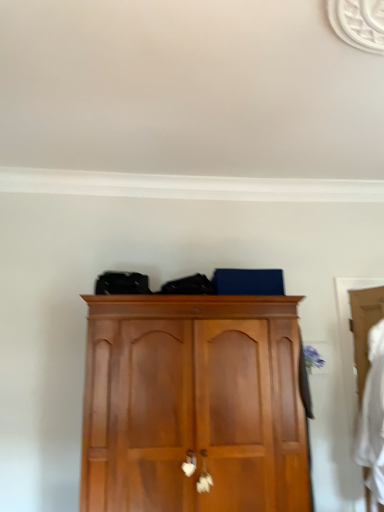
Question: Is white fabric at right directly adjacent to wooden wardrobe at right?

Choices:
 (A) yes
 (B) no

Answer: (B)

Question: Considering the relative sizes of white fabric at right and wooden wardrobe at right in the image provided, is white fabric at right thinner than wooden wardrobe at right?

Choices:
 (A) no
 (B) yes

Answer: (A)

Question: Does white fabric at right have a larger size compared to wooden wardrobe at right?

Choices:
 (A) yes
 (B) no

Answer: (A)

Question: Is white fabric at right at the right side of wooden wardrobe at right?

Choices:
 (A) no
 (B) yes

Answer: (B)

Question: From the image's perspective, is white fabric at right on wooden wardrobe at right?

Choices:
 (A) no
 (B) yes

Answer: (A)

Question: From the image's perspective, is white fabric at right below wooden wardrobe at right?

Choices:
 (A) yes
 (B) no

Answer: (A)

Question: Does wooden wardrobe at right appear on the left side of white fabric at right?

Choices:
 (A) yes
 (B) no

Answer: (A)

Question: Considering the relative positions of wooden wardrobe at right and white fabric at right in the image provided, is wooden wardrobe at right to the right of white fabric at right from the viewer's perspective?

Choices:
 (A) yes
 (B) no

Answer: (B)

Question: From a real-world perspective, is wooden wardrobe at right located higher than white fabric at right?

Choices:
 (A) no
 (B) yes

Answer: (B)

Question: Does wooden wardrobe at right have a lesser width compared to white fabric at right?

Choices:
 (A) yes
 (B) no

Answer: (A)

Question: Is the depth of wooden wardrobe at right less than that of white fabric at right?

Choices:
 (A) no
 (B) yes

Answer: (A)

Question: Is wooden wardrobe at right looking in the opposite direction of white fabric at right?

Choices:
 (A) no
 (B) yes

Answer: (B)

Question: Is wooden cupboard at center positioned with its back to wooden wardrobe at right?

Choices:
 (A) yes
 (B) no

Answer: (B)